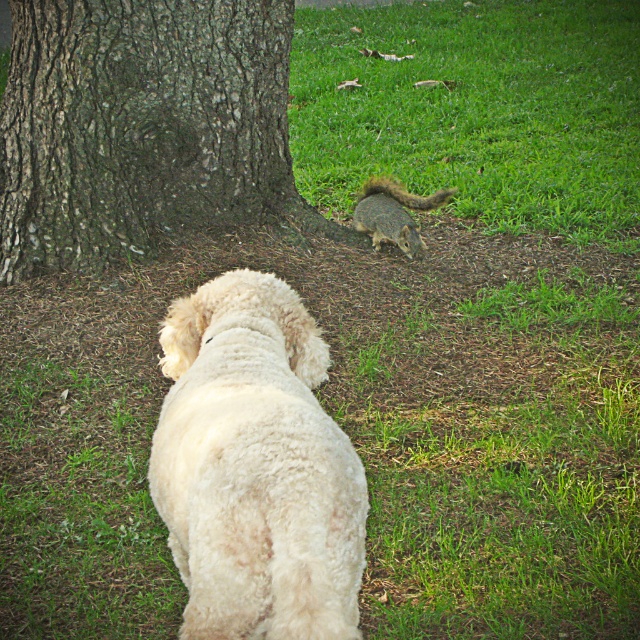
Does gray-furred squirrel at lower center have a lesser height compared to brown furry tail at lower center?

No.

The width and height of the screenshot is (640, 640). What do you see at coordinates (394, 212) in the screenshot?
I see `gray-furred squirrel at lower center` at bounding box center [394, 212].

Which is in front, point (371, 179) or point (376, 192)?

Positioned in front is point (371, 179).

Identify the location of gray-furred squirrel at lower center. This screenshot has width=640, height=640. (394, 212).

Is white fluffy dog at center closer to camera compared to brown furry tail at lower center?

That is True.

At what (x,y) coordinates should I click in order to perform the action: click on white fluffy dog at center. Please return your answer as a coordinate pair (x, y). This screenshot has width=640, height=640. Looking at the image, I should click on (256, 468).

Does point (298, 360) come in front of point (378, 189)?

Yes.

Locate an element on the screen. This screenshot has width=640, height=640. white fluffy dog at center is located at coordinates (256, 468).

Is point (266, 84) farther from viewer compared to point (294, 442)?

Yes, it is.

Image resolution: width=640 pixels, height=640 pixels. Describe the element at coordinates (144, 128) in the screenshot. I see `dark brown bark tree at center` at that location.

Is point (260, 129) positioned after point (333, 518)?

Yes, it is behind point (333, 518).

The image size is (640, 640). Identify the location of dark brown bark tree at center. (144, 128).